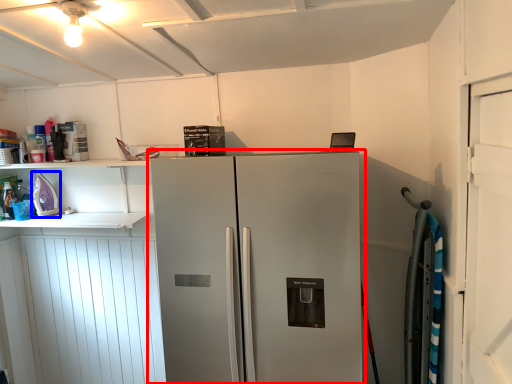
Question: Which object is further to the camera taking this photo, refrigerator (highlighted by a red box) or appliance (highlighted by a blue box)?

Choices:
 (A) refrigerator
 (B) appliance

Answer: (B)